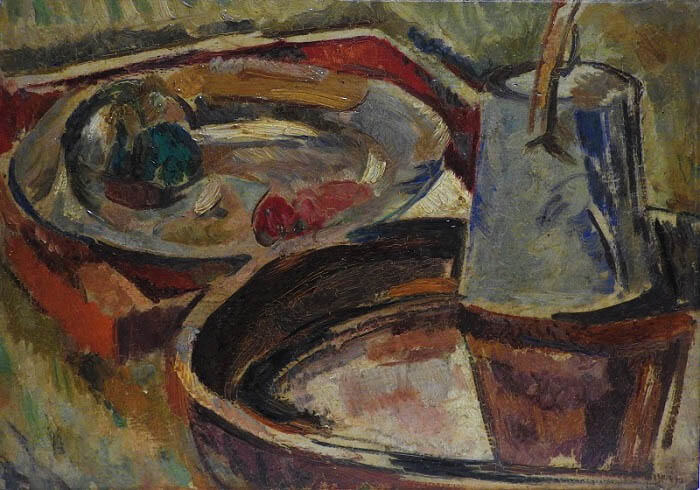
At what (x,y) coordinates should I click in order to perform the action: click on glass. Please return your answer as a coordinate pair (x, y). This screenshot has width=700, height=490. Looking at the image, I should click on (544, 241).